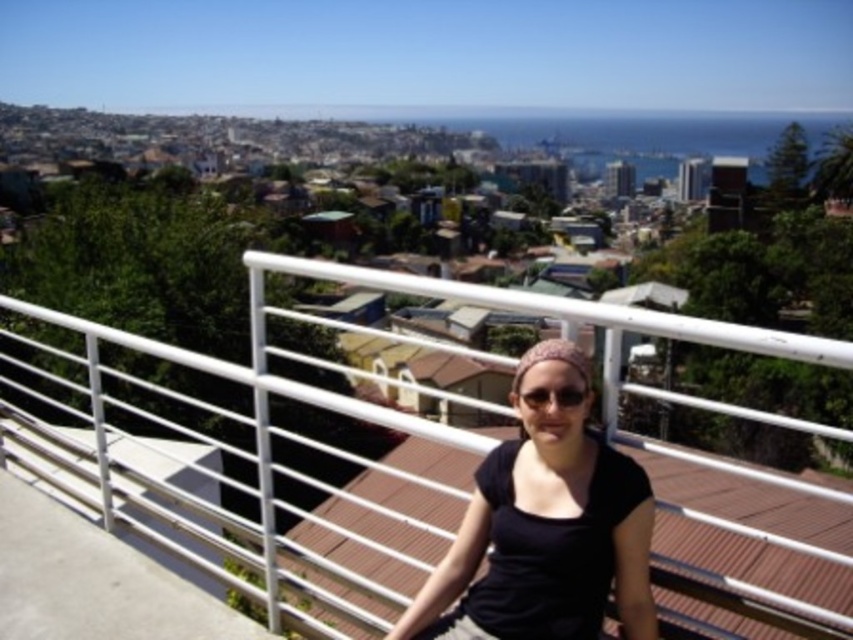
You are standing at the elevated vantage point looking at the city. You see the white metal railing at center and the black plastic sunglasses at center. Which object is closer to the horizon?

The white metal railing at center is located below the black plastic sunglasses at center, so the sunglasses are closer to the horizon.

You are a tailor measuring the width of clothing items in the image. You need to determine if the black matte shirt at center can fit over the black plastic sunglasses at center without overlapping. Can it?

The black matte shirt at center might be wider than black plastic sunglasses at center, so there is a possibility that the shirt could cover the sunglasses without overlapping, but this depends on their exact dimensions and positioning.

You are a photographer trying to capture a clear shot of the black matte shirt at center and the black plastic sunglasses at center. Since both are at the center, which one will be more visible in your photo?

The black matte shirt at center is taller than the black plastic sunglasses at center, so the black matte shirt at center will be more visible in the photo.